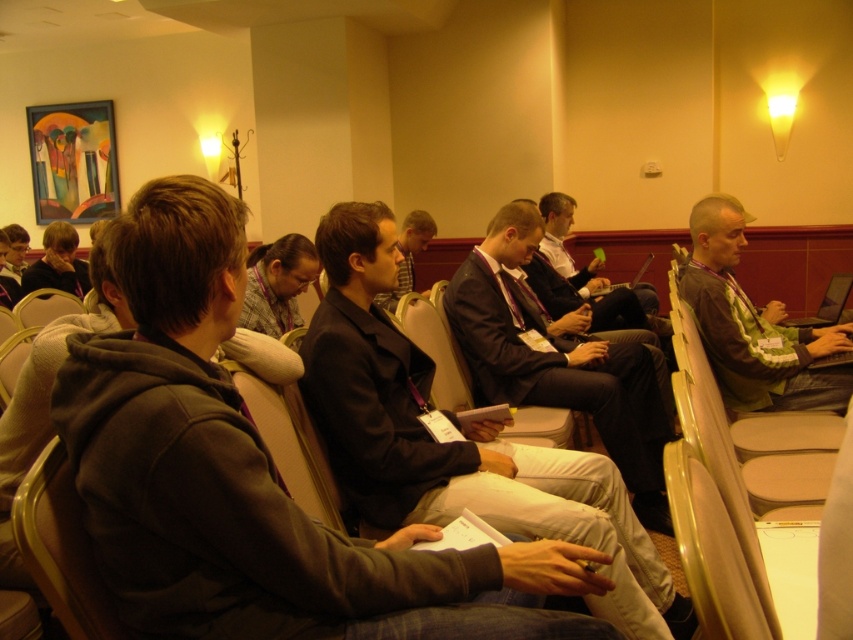
You are a conference attendee standing at the entrance of the room. You need to hand a document to the person wearing the green fabric shirt at right and the matte black jacket at center. If you can only walk 1.5 meters before needing to rest, which person should you approach first?

The distance between the green fabric shirt at right and the matte black jacket at center is 2.02 meters. Since you can only walk 1.5 meters before resting, you should approach the person wearing the matte black jacket at center first as they are closer to your starting position at the entrance compared to the green fabric shirt at right.